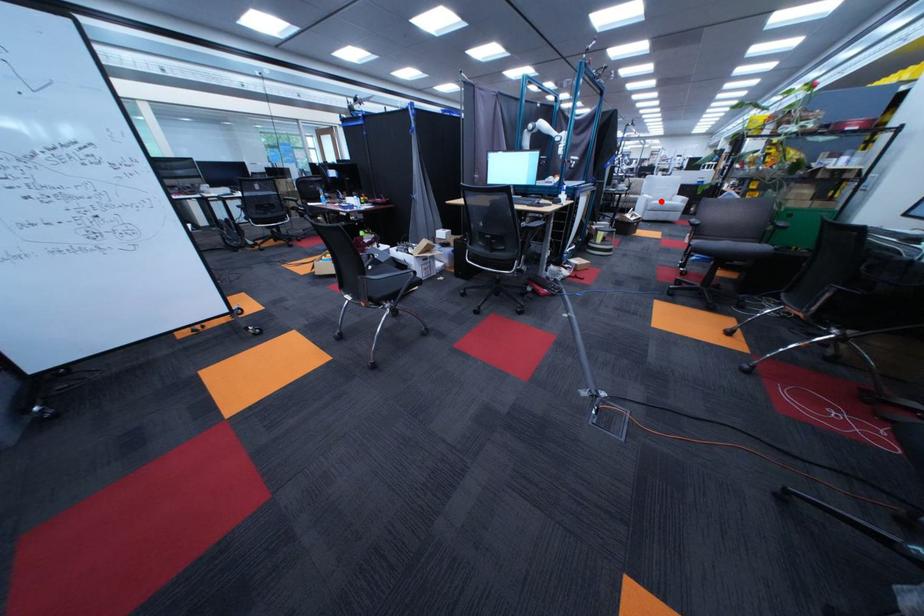
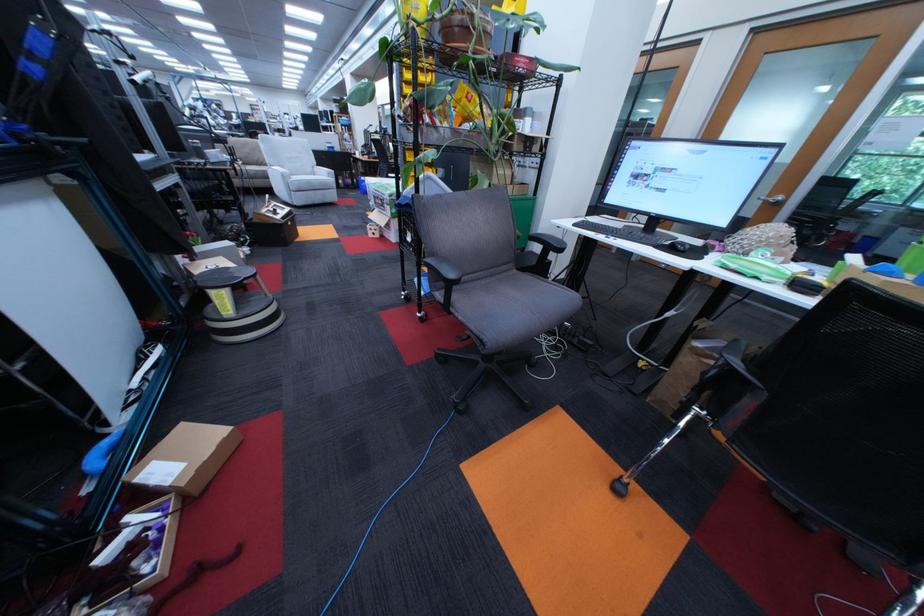
Question: I am providing you with two images of the same scene from different viewpoints. Image1 has a red point marked. In image2, the corresponding 3D location appears at what relative position? Reply with the corresponding letter.

Choices:
 (A) Closer
 (B) Farther

Answer: (A)